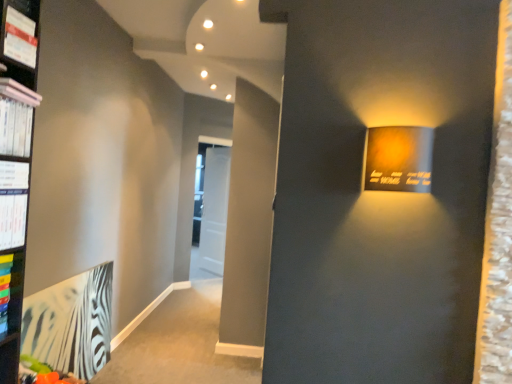
This screenshot has height=384, width=512. Describe the element at coordinates (13, 220) in the screenshot. I see `white paper at left, the first paperback book in the top-to-bottom sequence` at that location.

You are a GUI agent. You are given a task and a screenshot of the screen. Output one action in this format:
    pyautogui.click(x=<x>, y=<y>)
    Task: Click on the zebra-patterned paper at lower left, the 2th paperback book from the right
    Image resolution: width=512 pixels, height=384 pixels.
    Given the screenshot: What is the action you would take?
    pyautogui.click(x=71, y=323)

What do you see at coordinates (71, 323) in the screenshot?
I see `zebra-patterned paper at lower left, placed as the 2th paperback book when sorted from front to back` at bounding box center [71, 323].

The image size is (512, 384). Identify the location of pink matte book at upper left. (19, 92).

Identify the location of white paper at left, marked as the first paperback book in a front-to-back arrangement. pos(13,220).

From a real-world perspective, is zebra-patterned paper at lower left, the 2th paperback book from the right, positioned above or below matte white magazine at upper left, placed as the 1th magazine when sorted from top to bottom?

zebra-patterned paper at lower left, the 2th paperback book from the right, is below matte white magazine at upper left, placed as the 1th magazine when sorted from top to bottom.

In terms of height, does zebra-patterned paper at lower left, placed as the 2th paperback book when sorted from front to back, look taller or shorter compared to matte white magazine at upper left, positioned as the second magazine in bottom-to-top order?

zebra-patterned paper at lower left, placed as the 2th paperback book when sorted from front to back, is taller than matte white magazine at upper left, positioned as the second magazine in bottom-to-top order.

Is zebra-patterned paper at lower left, the 2th paperback book from the right, not inside matte white magazine at upper left, positioned as the second magazine in bottom-to-top order?

Yes, zebra-patterned paper at lower left, the 2th paperback book from the right, is not within matte white magazine at upper left, positioned as the second magazine in bottom-to-top order.

Who is bigger, zebra-patterned paper at lower left, which is the 1th paperback book in bottom-to-top order, or matte white magazine at upper left, positioned as the second magazine in bottom-to-top order?

zebra-patterned paper at lower left, which is the 1th paperback book in bottom-to-top order.

Image resolution: width=512 pixels, height=384 pixels. Find the location of `paperback book on the right side of zebra-patterned paper at lower left, the 2th paperback book from the right`. paperback book on the right side of zebra-patterned paper at lower left, the 2th paperback book from the right is located at coordinates (13, 220).

Is zebra-patterned paper at lower left, placed as the 2th paperback book when sorted from front to back, far away from white paper at left, acting as the first paperback book starting from the right?

Absolutely, zebra-patterned paper at lower left, placed as the 2th paperback book when sorted from front to back, is distant from white paper at left, acting as the first paperback book starting from the right.

Is zebra-patterned paper at lower left, placed as the 2th paperback book when sorted from front to back, at the right side of white paper at left, acting as the first paperback book starting from the right?

In fact, zebra-patterned paper at lower left, placed as the 2th paperback book when sorted from front to back, is to the left of white paper at left, acting as the first paperback book starting from the right.

Considering the sizes of objects zebra-patterned paper at lower left, which is the 1th paperback book in bottom-to-top order, and white paper at left, marked as the first paperback book in a front-to-back arrangement, in the image provided, who is bigger, zebra-patterned paper at lower left, which is the 1th paperback book in bottom-to-top order, or white paper at left, marked as the first paperback book in a front-to-back arrangement,?

Bigger between the two is zebra-patterned paper at lower left, which is the 1th paperback book in bottom-to-top order.

Is white glossy magazine at left, the 2th magazine from the top, next to white paper at left, the second paperback book in the bottom-to-top sequence, and touching it?

No, white glossy magazine at left, the 2th magazine from the top, is not in contact with white paper at left, the second paperback book in the bottom-to-top sequence.

Between point (8, 104) and point (12, 233), which one is positioned in front?

The point (8, 104) is in front.

Based on the photo, from the image's perspective, is white glossy magazine at left, acting as the 1th magazine starting from the bottom, over white paper at left, acting as the first paperback book starting from the right?

Yes.

Considering the relative positions of white glossy magazine at left, the 2th magazine from the top, and zebra-patterned paper at lower left, the 2th paperback book in the top-to-bottom sequence, in the image provided, is white glossy magazine at left, the 2th magazine from the top, to the left of zebra-patterned paper at lower left, the 2th paperback book in the top-to-bottom sequence, from the viewer's perspective?

No.

From the image's perspective, which one is positioned lower, white glossy magazine at left, the 2th magazine from the top, or zebra-patterned paper at lower left, the 2th paperback book in the top-to-bottom sequence?

zebra-patterned paper at lower left, the 2th paperback book in the top-to-bottom sequence.

Can you confirm if white glossy magazine at left, acting as the 1th magazine starting from the bottom, is wider than zebra-patterned paper at lower left, the 2th paperback book from the right?

Correct, the width of white glossy magazine at left, acting as the 1th magazine starting from the bottom, exceeds that of zebra-patterned paper at lower left, the 2th paperback book from the right.

Who is taller, white paper at left, which is the 2th paperback book in back-to-front order, or matte white magazine at upper left, placed as the 1th magazine when sorted from top to bottom?

white paper at left, which is the 2th paperback book in back-to-front order, is taller.

From the image's perspective, which object appears higher, white paper at left, the first paperback book in the top-to-bottom sequence, or matte white magazine at upper left, placed as the 1th magazine when sorted from top to bottom?

From the image's view, matte white magazine at upper left, placed as the 1th magazine when sorted from top to bottom, is above.

Would you consider white paper at left, marked as the first paperback book in a front-to-back arrangement, to be distant from matte white magazine at upper left, placed as the 1th magazine when sorted from top to bottom?

Actually, white paper at left, marked as the first paperback book in a front-to-back arrangement, and matte white magazine at upper left, placed as the 1th magazine when sorted from top to bottom, are a little close together.

From the image's perspective, which object appears higher, pink matte book at upper left or white glossy magazine at left, acting as the 1th magazine starting from the bottom?

pink matte book at upper left.

Is pink matte book at upper left not within white glossy magazine at left, acting as the 1th magazine starting from the bottom?

Absolutely, pink matte book at upper left is external to white glossy magazine at left, acting as the 1th magazine starting from the bottom.

Is white glossy magazine at left, the 2th magazine from the top, at the back of pink matte book at upper left?

No, pink matte book at upper left is not facing away from white glossy magazine at left, the 2th magazine from the top.

Is white glossy magazine at left, the 2th magazine from the top, at the back of zebra-patterned paper at lower left, which is the 1th paperback book in bottom-to-top order?

No, zebra-patterned paper at lower left, which is the 1th paperback book in bottom-to-top order, is not facing the opposite direction of white glossy magazine at left, the 2th magazine from the top.

Is zebra-patterned paper at lower left, the 2th paperback book from the right, at the right side of white glossy magazine at left, acting as the 1th magazine starting from the bottom?

No.

From a real-world perspective, starting from the zebra-patterned paper at lower left, the 1th paperback book positioned from the back, which magazine is the 1st one vertically above it? Please provide its 2D coordinates.

[(16, 118)]

Which object is wider, zebra-patterned paper at lower left, acting as the first paperback book starting from the left, or white glossy magazine at left, the 2th magazine from the top?

white glossy magazine at left, the 2th magazine from the top, is wider.

At what (x,y) coordinates should I click in order to perform the action: click on magazine that is the 2nd object to the right of the zebra-patterned paper at lower left, placed as the 2th paperback book when sorted from front to back, starting at the anchor. Please return your answer as a coordinate pair (x, y). Looking at the image, I should click on (20, 38).

This screenshot has height=384, width=512. In order to click on paperback book that is on the left side of white paper at left, the 2th paperback book viewed from the left in this screenshot , I will do `click(71, 323)`.

From the image, which object appears to be farther from matte white magazine at upper left, placed as the 1th magazine when sorted from top to bottom, zebra-patterned paper at lower left, acting as the first paperback book starting from the left, or pink matte book at upper left?

Answer: zebra-patterned paper at lower left, acting as the first paperback book starting from the left, is positioned further to the anchor matte white magazine at upper left, placed as the 1th magazine when sorted from top to bottom.

Based on their spatial positions, is zebra-patterned paper at lower left, the 2th paperback book in the top-to-bottom sequence, or white glossy magazine at left, the 2th magazine from the top, closer to white paper at left, acting as the first paperback book starting from the right?

white glossy magazine at left, the 2th magazine from the top, lies closer to white paper at left, acting as the first paperback book starting from the right, than the other object.

Based on their spatial positions, is white glossy magazine at left, acting as the 1th magazine starting from the bottom, or pink matte book at upper left further from white paper at left, which is the 2th paperback book in back-to-front order?

pink matte book at upper left is positioned further to the anchor white paper at left, which is the 2th paperback book in back-to-front order.

Estimate the real-world distances between objects in this image. Which object is further from zebra-patterned paper at lower left, the 1th paperback book positioned from the back, white glossy magazine at left, acting as the 1th magazine starting from the bottom, or matte white magazine at upper left, placed as the 1th magazine when sorted from top to bottom?

Based on the image, matte white magazine at upper left, placed as the 1th magazine when sorted from top to bottom, appears to be further to zebra-patterned paper at lower left, the 1th paperback book positioned from the back.

Based on their spatial positions, is white paper at left, which is the 2th paperback book in back-to-front order, or pink matte book at upper left further from zebra-patterned paper at lower left, the 1th paperback book positioned from the back?

The object further to zebra-patterned paper at lower left, the 1th paperback book positioned from the back, is pink matte book at upper left.

Looking at the image, which one is located closer to matte white magazine at upper left, placed as the 1th magazine when sorted from top to bottom, pink matte book at upper left or white glossy magazine at left, the 2th magazine from the top?

Among the two, pink matte book at upper left is located nearer to matte white magazine at upper left, placed as the 1th magazine when sorted from top to bottom.

Estimate the real-world distances between objects in this image. Which object is closer to white paper at left, which is the 2th paperback book in back-to-front order, white glossy magazine at left, acting as the 1th magazine starting from the bottom, or zebra-patterned paper at lower left, the 2th paperback book in the top-to-bottom sequence?

white glossy magazine at left, acting as the 1th magazine starting from the bottom.

Which object lies nearer to the anchor point white paper at left, the 2th paperback book viewed from the left, matte white magazine at upper left, placed as the 1th magazine when sorted from top to bottom, or white glossy magazine at left, acting as the 1th magazine starting from the bottom?

Among the two, white glossy magazine at left, acting as the 1th magazine starting from the bottom, is located nearer to white paper at left, the 2th paperback book viewed from the left.

Locate an element on the screen. This screenshot has width=512, height=384. magazine that lies between matte white magazine at upper left, placed as the 1th magazine when sorted from top to bottom, and zebra-patterned paper at lower left, the 1th paperback book positioned from the back, from top to bottom is located at coordinates (16, 118).

At what (x,y) coordinates should I click in order to perform the action: click on paperback book that lies between white glossy magazine at left, the 2th magazine from the top, and zebra-patterned paper at lower left, placed as the 2th paperback book when sorted from front to back, from top to bottom. Please return your answer as a coordinate pair (x, y). Looking at the image, I should click on (13, 220).

The width and height of the screenshot is (512, 384). What are the coordinates of `paperback book between pink matte book at upper left and zebra-patterned paper at lower left, placed as the 2th paperback book when sorted from front to back, from top to bottom` in the screenshot? It's located at (13, 220).

This screenshot has height=384, width=512. In order to click on book between matte white magazine at upper left, positioned as the second magazine in bottom-to-top order, and white paper at left, the second paperback book in the bottom-to-top sequence, from top to bottom in this screenshot , I will do `click(19, 92)`.